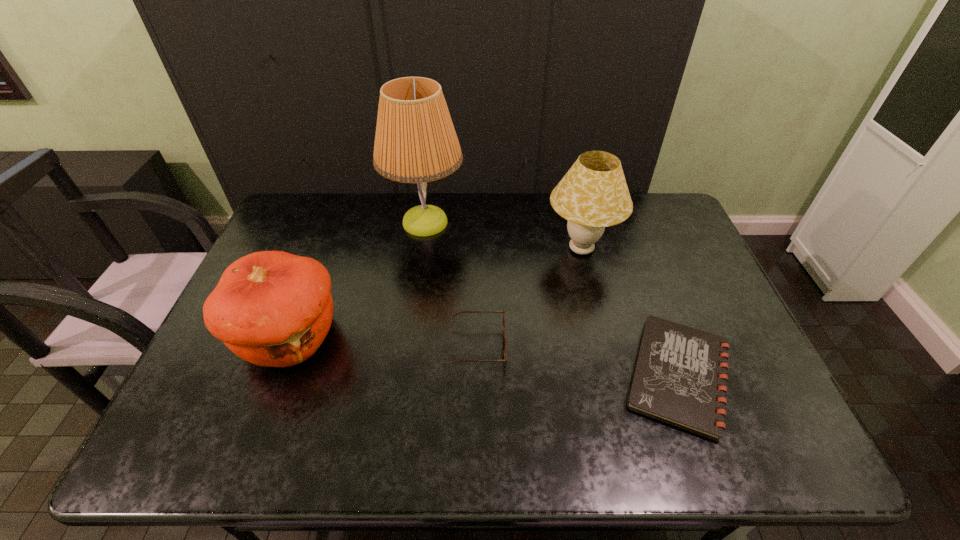
Locate an element on the screen. blank region between the second tallest object and the pumpkin is located at coordinates (436, 293).

At what (x,y) coordinates should I click in order to perform the action: click on free space between the spectacles and the fourth shortest object. Please return your answer as a coordinate pair (x, y). Looking at the image, I should click on (530, 298).

Locate an element on the screen. Image resolution: width=960 pixels, height=540 pixels. free space between the lampshade and the shortest object is located at coordinates (630, 313).

Select which object is the fourth closest to the tallest object. Please provide its 2D coordinates. Your answer should be formatted as a tuple, i.e. [(x, y)], where the tuple contains the x and y coordinates of a point satisfying the conditions above.

[(680, 378)]

Identify which object is the nearest to the tallest object. Please provide its 2D coordinates. Your answer should be formatted as a tuple, i.e. [(x, y)], where the tuple contains the x and y coordinates of a point satisfying the conditions above.

[(271, 308)]

Where is `vacant space that satisfies the following two spatial constraints: 1. on the front side of the shortest object; 2. on the left side of the pumpkin`? The height and width of the screenshot is (540, 960). vacant space that satisfies the following two spatial constraints: 1. on the front side of the shortest object; 2. on the left side of the pumpkin is located at coordinates (276, 376).

Image resolution: width=960 pixels, height=540 pixels. Identify the location of vacant position in the image that satisfies the following two spatial constraints: 1. on the side of the notebook near the pull switch; 2. on the left side of the tallest object. (403, 376).

The width and height of the screenshot is (960, 540). In order to click on free spot that satisfies the following two spatial constraints: 1. on the side of the tallest object near the pull switch; 2. on the left side of the lampshade in this screenshot , I will do `click(421, 249)`.

Find the location of a particular element. The width and height of the screenshot is (960, 540). vacant space that satisfies the following two spatial constraints: 1. on the side of the lamp near the pull switch; 2. on the back side of the notebook is located at coordinates (x=403, y=376).

Find the location of a particular element. The width and height of the screenshot is (960, 540). vacant region that satisfies the following two spatial constraints: 1. on the back side of the fourth shortest object; 2. on the right side of the leftmost object is located at coordinates pos(324,249).